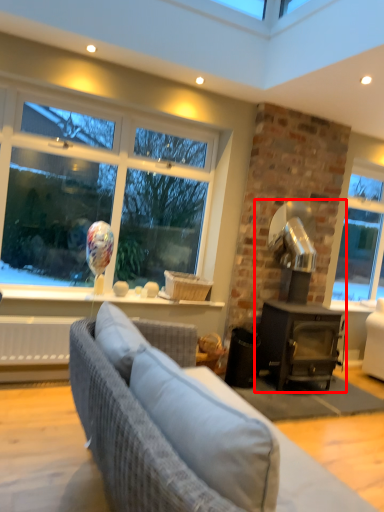
Question: From the image's perspective, considering the relative positions of fireplace (annotated by the red box) and studio couch in the image provided, where is fireplace (annotated by the red box) located with respect to the staircase?

Choices:
 (A) above
 (B) below

Answer: (A)